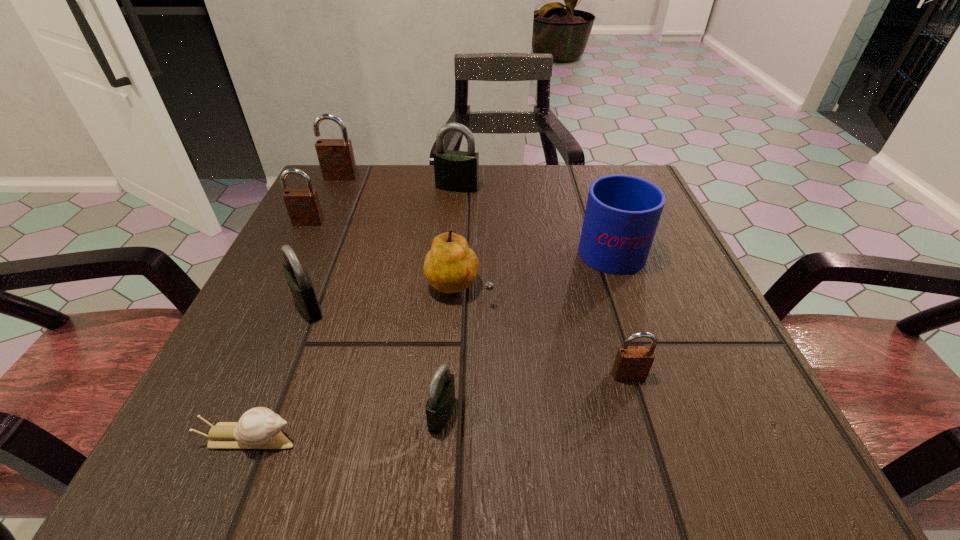
Where is `vacant space located on the front-facing side of the second biggest brown padlock`? This screenshot has width=960, height=540. vacant space located on the front-facing side of the second biggest brown padlock is located at coordinates (231, 376).

This screenshot has width=960, height=540. In order to click on free spot located on the front of the second smallest black padlock in this screenshot , I will do `click(270, 401)`.

Where is `vacant area situated on the front of the pear`? vacant area situated on the front of the pear is located at coordinates (456, 342).

Locate an element on the screen. This screenshot has height=540, width=960. vacant region located on the front-facing side of the rightmost brown padlock is located at coordinates (640, 414).

Locate an element on the screen. This screenshot has height=540, width=960. free space located 0.320m on the right of the smallest black padlock is located at coordinates (702, 414).

Find the location of a particular element. vacant space located 0.380m on the shell of the escargot is located at coordinates (603, 438).

You are a GUI agent. You are given a task and a screenshot of the screen. Output one action in this format:
    pyautogui.click(x=<x>, y=<y>)
    Task: Click on the mug at the far edge
    Image resolution: width=960 pixels, height=540 pixels.
    Given the screenshot: What is the action you would take?
    pyautogui.click(x=622, y=213)

Locate an element on the screen. padlock at the near edge is located at coordinates (441, 396).

You are a GUI agent. You are given a task and a screenshot of the screen. Output one action in this format:
    pyautogui.click(x=<x>, y=<y>)
    Task: Click on the escargot that is at the near edge
    
    Given the screenshot: What is the action you would take?
    pyautogui.click(x=258, y=428)

Find the location of a particular element. This screenshot has width=960, height=540. escargot that is at the left edge is located at coordinates (258, 428).